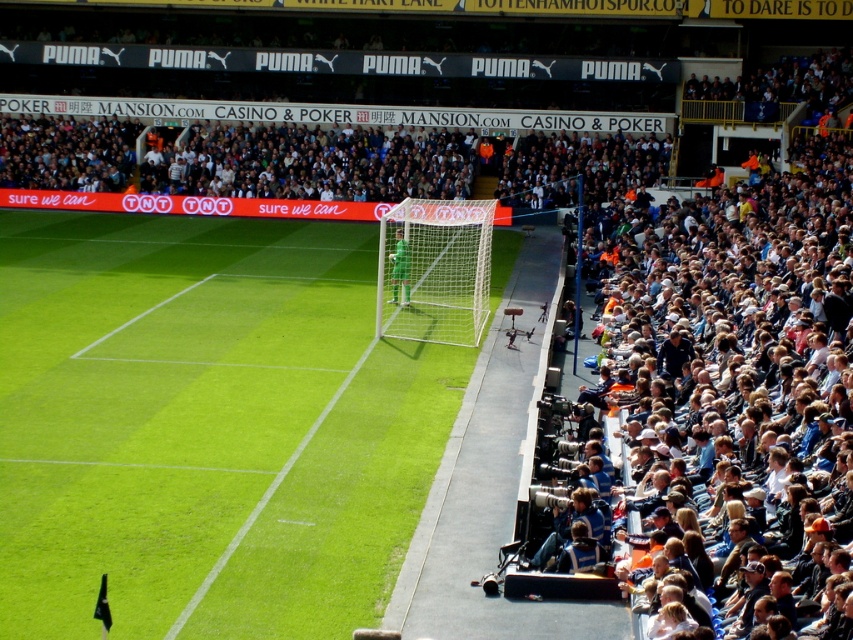
Is green grass at center further to camera compared to green jersey at center?

That is False.

How distant is green grass at center from green jersey at center?

green grass at center and green jersey at center are 14.41 feet apart.

Is point (397, 518) farther from viewer compared to point (408, 298)?

That is False.

Where is `green grass at center`? green grass at center is located at coordinates (206, 426).

Does white net at center have a larger size compared to green jersey at center?

Correct, white net at center is larger in size than green jersey at center.

Can you confirm if white net at center is positioned to the right of green jersey at center?

Yes, white net at center is to the right of green jersey at center.

Image resolution: width=853 pixels, height=640 pixels. I want to click on white net at center, so click(434, 269).

The image size is (853, 640). I want to click on green grass at center, so click(x=206, y=426).

Between point (311, 237) and point (407, 230), which one is positioned in front?

Point (407, 230) is more forward.

The image size is (853, 640). I want to click on green grass at center, so click(x=206, y=426).